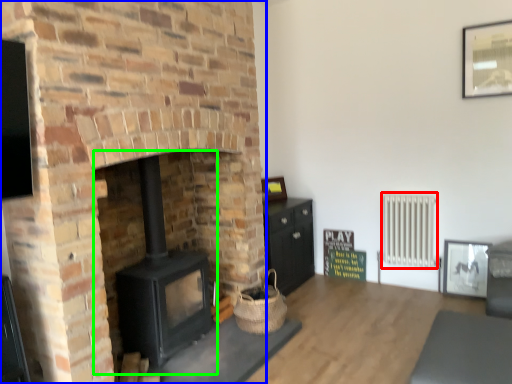
Question: Based on their relative distances, which object is nearer to radiator (highlighted by a red box)? Choose from fireplace (highlighted by a blue box) and wood burning stove (highlighted by a green box).

Choices:
 (A) fireplace
 (B) wood burning stove

Answer: (A)